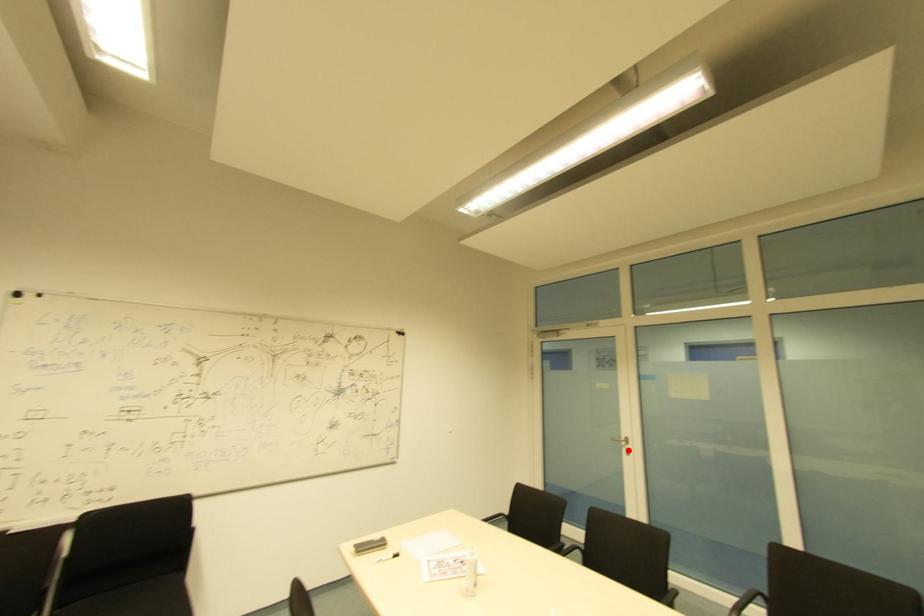
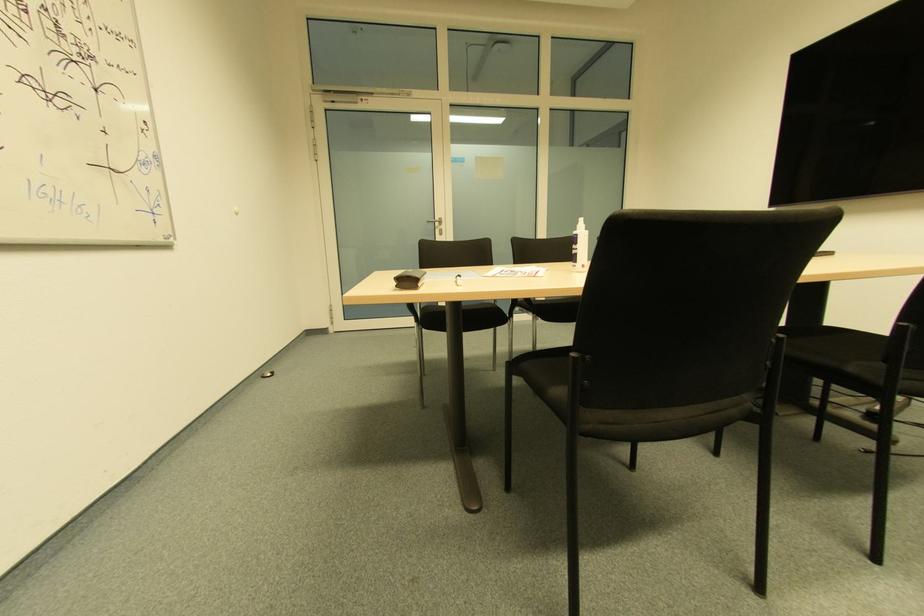
Where in the second image is the point corresponding to the highlighted location from the first image?

(440, 230)